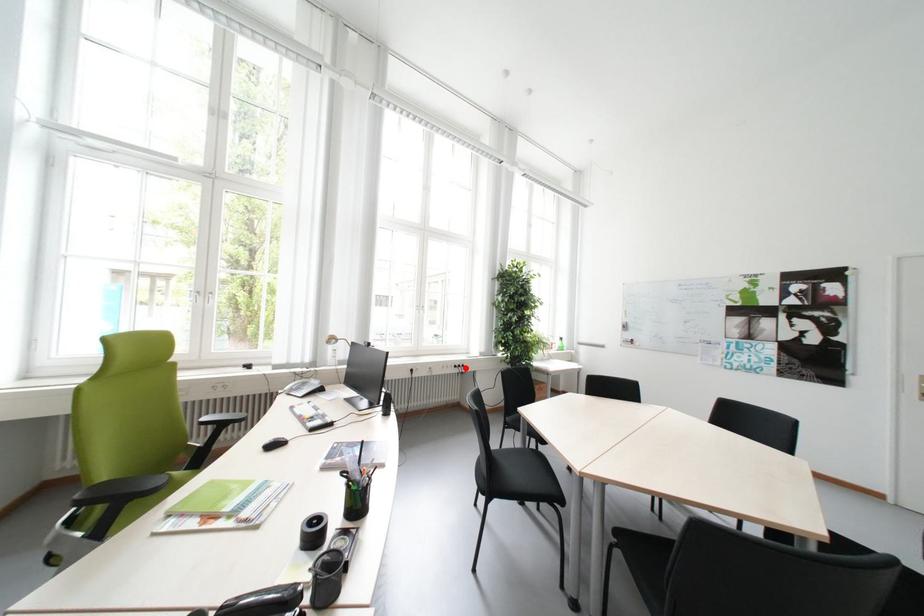
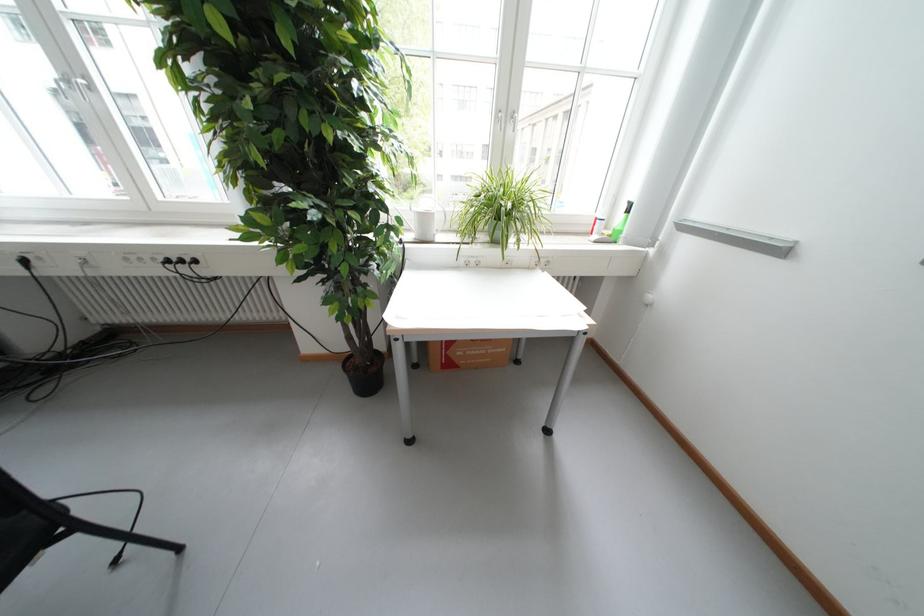
Question: I am providing you with two images of the same scene from different viewpoints. In image1, a red point is highlighted. Considering the same 3D point in image2, which of the following is correct?

Choices:
 (A) It is closer
 (B) It is farther

Answer: (A)